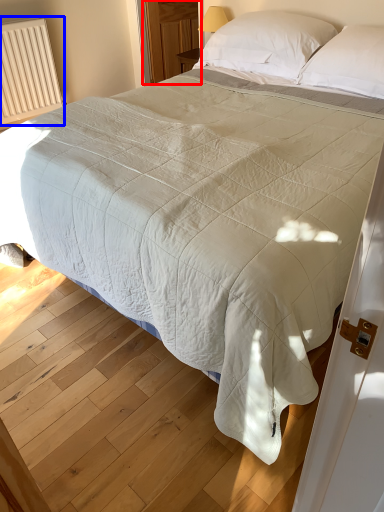
Question: Which of the following is the farthest to the observer, glass door (highlighted by a red box) or radiator (highlighted by a blue box)?

Choices:
 (A) glass door
 (B) radiator

Answer: (A)